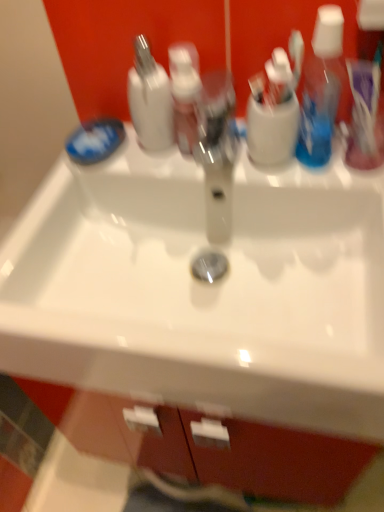
Image resolution: width=384 pixels, height=512 pixels. Find the location of `vacant space situated on the left part of translucent plastic toothbrush at upper right`. vacant space situated on the left part of translucent plastic toothbrush at upper right is located at coordinates (267, 163).